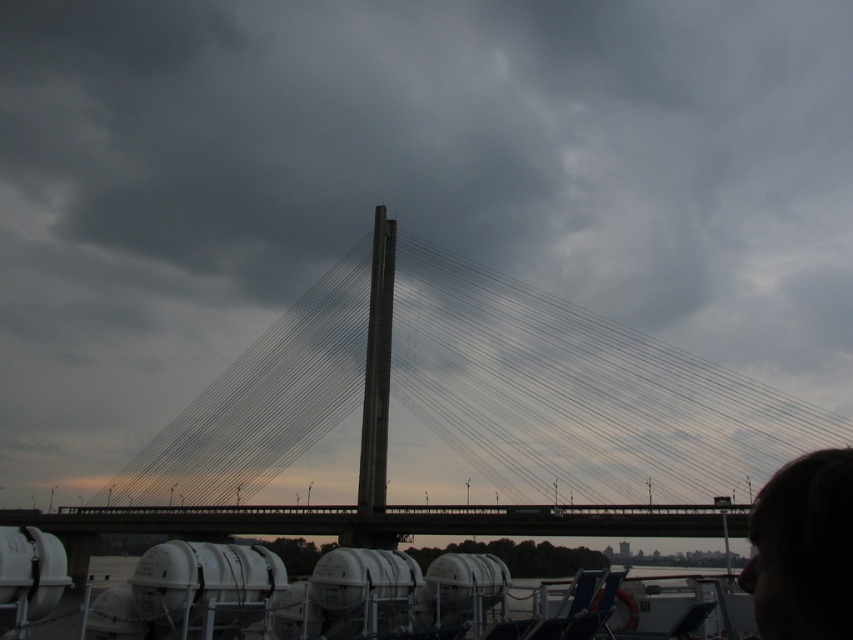
You are standing at the base of the suspension bridge and see two points marked in the image. The first point is labeled as point [440,342] and the second is point [743,589]. From your current position, which point is closer to you?

Point [743,589] is closer to you because the description states that point [440,342] is behind point [743,589].

You are a photographer positioned at the dock with the white cylindrical objects. You want to capture a photo of the dark hair at upper right without the concrete bridge at center obstructing it. Is this possible?

The dark hair at upper right is behind the concrete bridge at center, so it will be obstructed by the bridge in the photo.